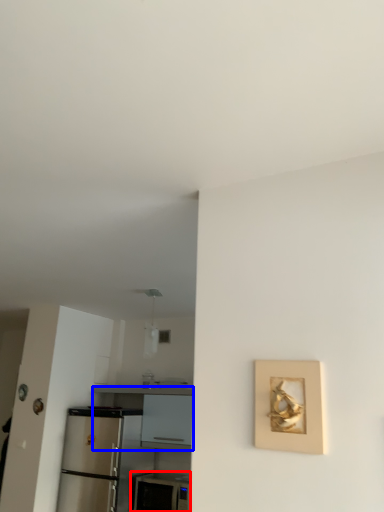
Question: Which object appears farthest to the camera in this image, appliance (highlighted by a red box) or counter (highlighted by a blue box)?

Choices:
 (A) appliance
 (B) counter

Answer: (B)